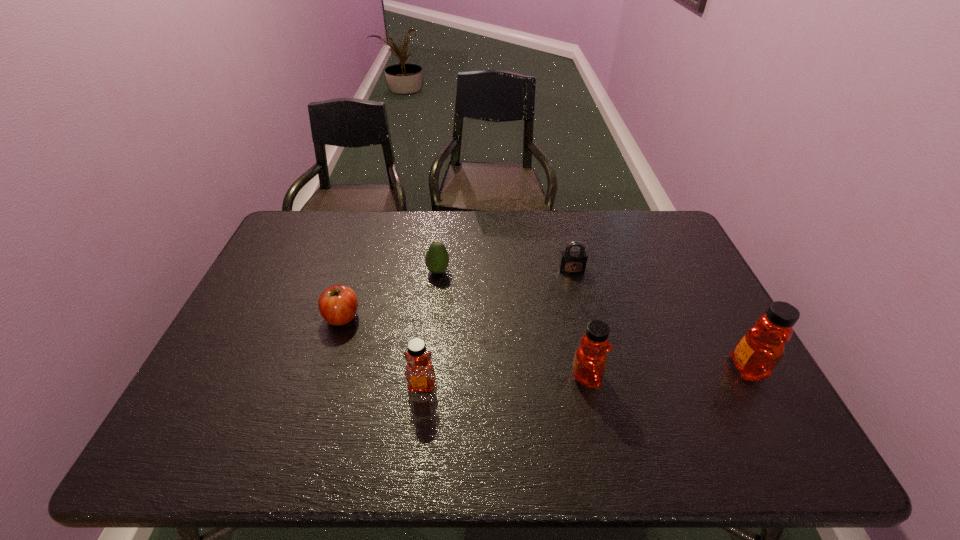
Locate an element on the screen. free location located 0.330m on the front label of the rightmost object is located at coordinates (597, 368).

Locate an element on the screen. The height and width of the screenshot is (540, 960). vacant region located on the front label of the rightmost object is located at coordinates (616, 368).

Where is `free point located on the front label of the rightmost object`? This screenshot has width=960, height=540. free point located on the front label of the rightmost object is located at coordinates (701, 368).

At what (x,y) coordinates should I click in order to perform the action: click on free space located 0.140m on the back of the fourth nearest object. Please return your answer as a coordinate pair (x, y). The width and height of the screenshot is (960, 540). Looking at the image, I should click on (356, 271).

Find the location of a particular element. Image resolution: width=960 pixels, height=540 pixels. vacant space located on the right of the avocado is located at coordinates (489, 271).

At what (x,y) coordinates should I click in order to perform the action: click on free space located 0.230m on the front of the padlock near the keyhole. Please return your answer as a coordinate pair (x, y). The image size is (960, 540). Looking at the image, I should click on (586, 330).

Locate an element on the screen. object that is at the right edge is located at coordinates (758, 352).

You are a GUI agent. You are given a task and a screenshot of the screen. Output one action in this format:
    pyautogui.click(x=<x>, y=<y>)
    Task: Click on the vacant space at the far edge of the desktop
    Image resolution: width=960 pixels, height=540 pixels.
    Given the screenshot: What is the action you would take?
    pyautogui.click(x=421, y=222)

Identify the location of free region at the near edge of the desktop. The width and height of the screenshot is (960, 540). coord(284,395).

At what (x,y) coordinates should I click in order to perform the action: click on free space at the left edge of the desktop. Please return your answer as a coordinate pair (x, y). The width and height of the screenshot is (960, 540). Looking at the image, I should click on (243, 324).